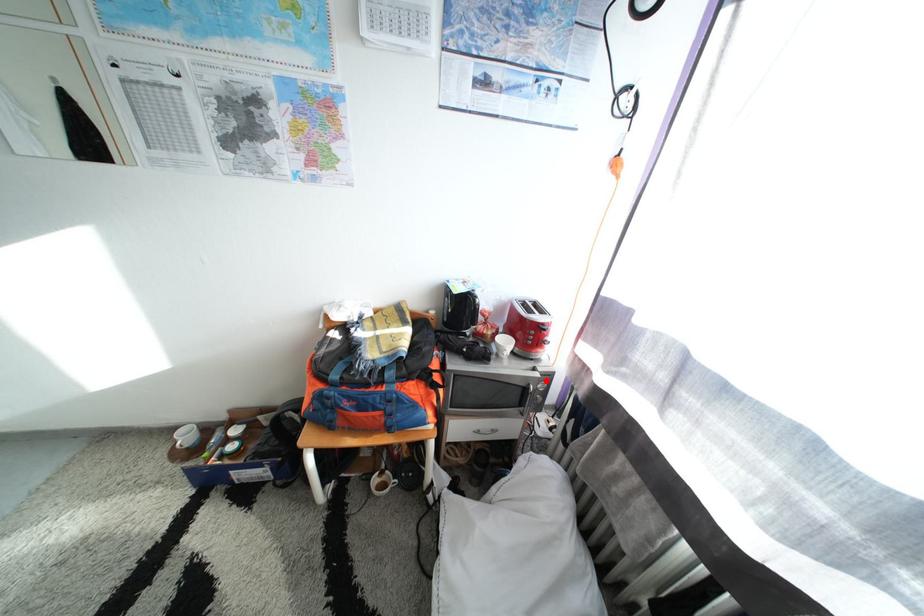
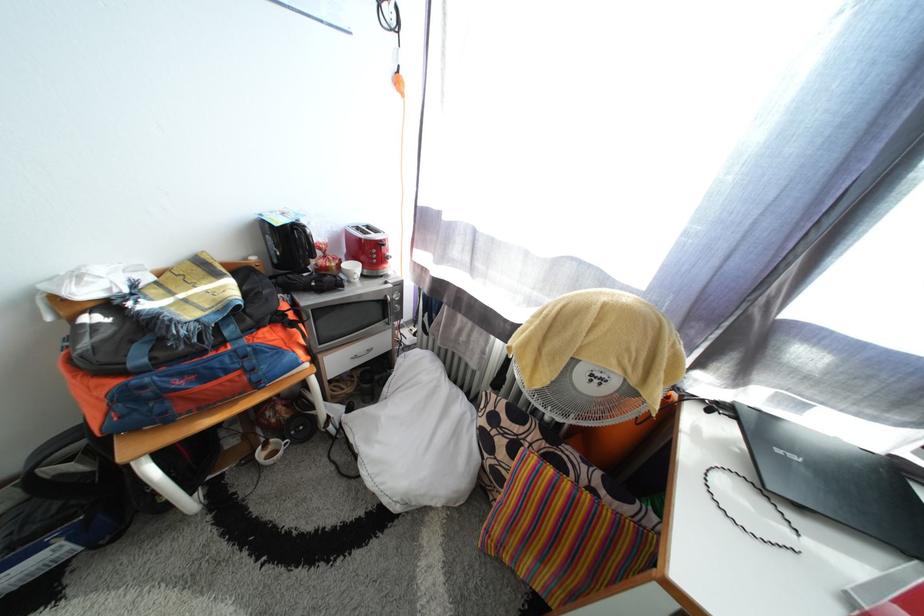
Question: I am providing you with two images of the same scene from different viewpoints. A red point is marked on the first image. Can you still see the location of the red point in image 2?

Choices:
 (A) Yes
 (B) No

Answer: (A)